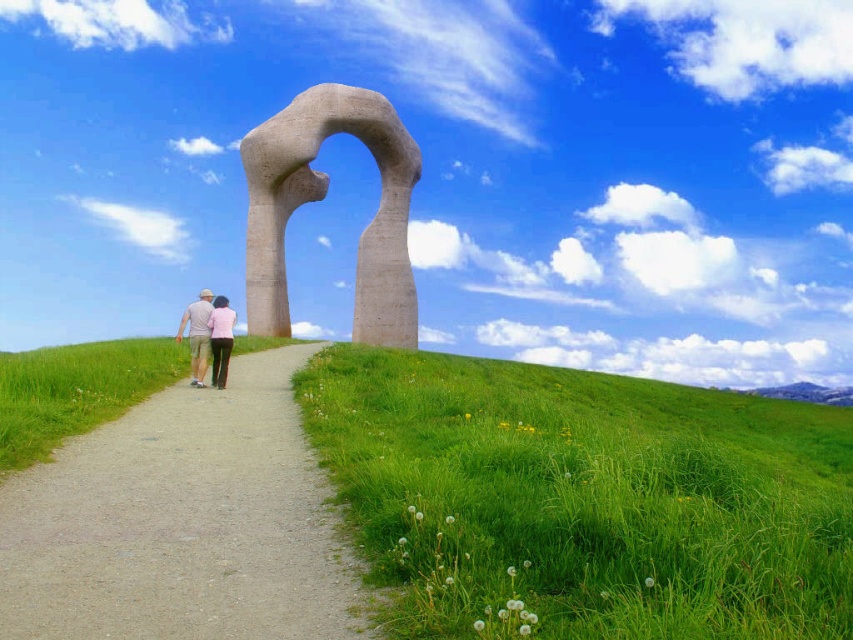
Question: Is gravel path at center to the left of concrete sculpture at center from the viewer's perspective?

Choices:
 (A) yes
 (B) no

Answer: (B)

Question: Can you confirm if light brown fabric pants at center is thinner than pink fabric at center?

Choices:
 (A) yes
 (B) no

Answer: (B)

Question: Is green grass at lower right further to camera compared to light brown fabric pants at center?

Choices:
 (A) yes
 (B) no

Answer: (B)

Question: Which object is closer to the camera taking this photo?

Choices:
 (A) green grass at lower right
 (B) gravel path at center

Answer: (B)

Question: Which object is closer to the camera taking this photo?

Choices:
 (A) concrete sculpture at center
 (B) pink fabric at center

Answer: (B)

Question: Which of the following is the farthest from the observer?

Choices:
 (A) gravel path at center
 (B) green grass at lower right
 (C) concrete sculpture at center

Answer: (C)